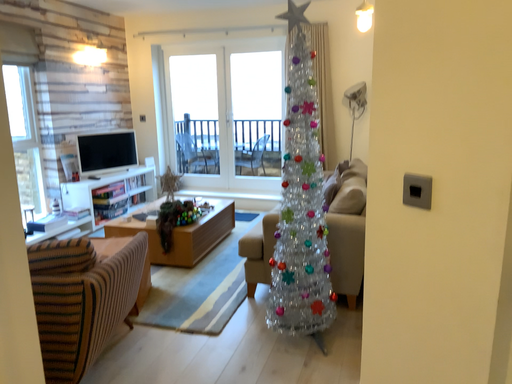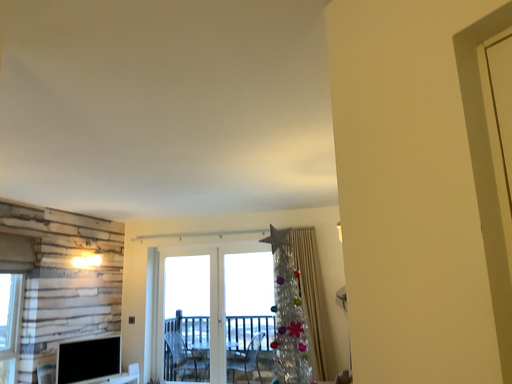
Question: How did the camera likely rotate when shooting the video?

Choices:
 (A) rotated upward
 (B) rotated downward

Answer: (A)